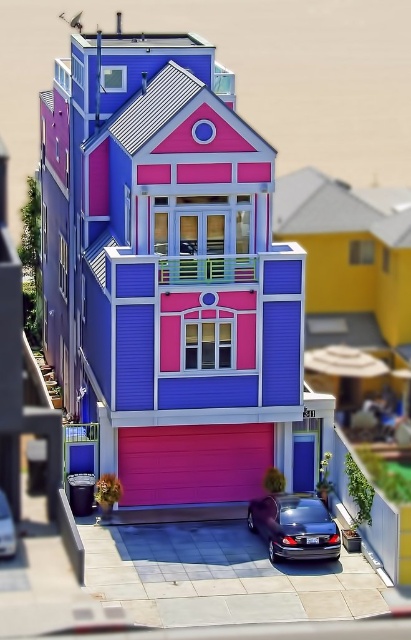
Question: Can you confirm if glossy metallic car at lower center is positioned to the left of shiny metallic car at lower center?

Choices:
 (A) no
 (B) yes

Answer: (A)

Question: Does glossy metallic car at lower center appear under shiny metallic car at lower center?

Choices:
 (A) yes
 (B) no

Answer: (A)

Question: Can you confirm if glossy metallic car at lower center is positioned to the right of shiny metallic car at lower center?

Choices:
 (A) no
 (B) yes

Answer: (B)

Question: Among these objects, which one is nearest to the camera?

Choices:
 (A) shiny metallic car at lower center
 (B) glossy metallic car at lower center

Answer: (A)

Question: Which object appears farthest from the camera in this image?

Choices:
 (A) shiny metallic car at lower center
 (B) glossy metallic car at lower center

Answer: (B)